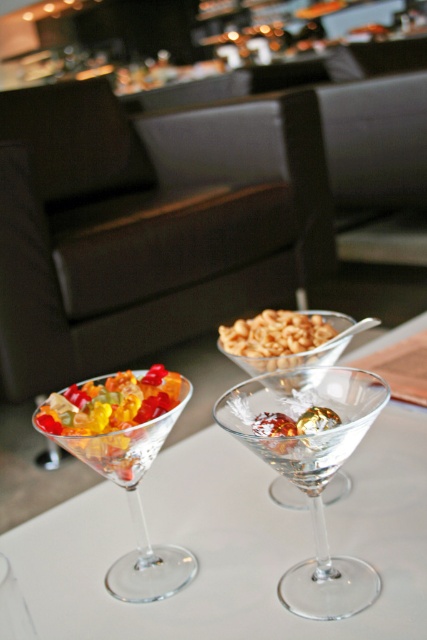
Question: Which point is closer to the camera?

Choices:
 (A) (73, 632)
 (B) (338, 435)

Answer: (B)

Question: Is transparent glass table at center to the right of translucent gelatinous candies at lower left from the viewer's perspective?

Choices:
 (A) yes
 (B) no

Answer: (A)

Question: Among these objects, which one is farthest from the camera?

Choices:
 (A) translucent glass martini glass at lower left
 (B) translucent glass bowl at center
 (C) transparent glass table at center
 (D) transparent glass at center

Answer: (B)

Question: Observing the image, what is the correct spatial positioning of transparent glass at center in reference to translucent glass bowl at center?

Choices:
 (A) left
 (B) right

Answer: (A)

Question: Which of the following is the farthest from the observer?

Choices:
 (A) (249, 440)
 (B) (139, 385)
 (C) (70, 408)
 (D) (266, 616)

Answer: (B)

Question: Considering the relative positions of transparent glass table at center and translucent glass martini glass at lower left in the image provided, where is transparent glass table at center located with respect to translucent glass martini glass at lower left?

Choices:
 (A) above
 (B) below

Answer: (A)